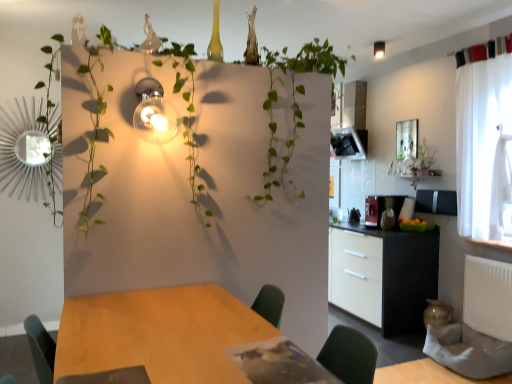
Question: Is green leafy plant at center outside of matte glass light fixture at upper right, which is the 1th light fixture in back-to-front order?

Choices:
 (A) no
 (B) yes

Answer: (B)

Question: Is green leafy plant at center oriented towards matte glass light fixture at upper right, the second light fixture positioned from the bottom?

Choices:
 (A) no
 (B) yes

Answer: (A)

Question: Does green leafy plant at center touch matte glass light fixture at upper right, the second light fixture positioned from the bottom?

Choices:
 (A) yes
 (B) no

Answer: (B)

Question: Does green leafy plant at center have a lesser width compared to matte glass light fixture at upper right, arranged as the first light fixture when viewed from the top?

Choices:
 (A) yes
 (B) no

Answer: (B)

Question: From a real-world perspective, is green leafy plant at center on top of matte glass light fixture at upper right, which appears as the 2th light fixture when viewed from the front?

Choices:
 (A) no
 (B) yes

Answer: (A)

Question: Is matte glass light fixture at upper right, the first light fixture positioned from the right, taller or shorter than black matte cabinet at right?

Choices:
 (A) tall
 (B) short

Answer: (B)

Question: Is matte glass light fixture at upper right, which is the second light fixture from left to right, bigger or smaller than black matte cabinet at right?

Choices:
 (A) big
 (B) small

Answer: (B)

Question: Is matte glass light fixture at upper right, the second light fixture positioned from the bottom, spatially inside black matte cabinet at right, or outside of it?

Choices:
 (A) inside
 (B) outside

Answer: (B)

Question: In terms of width, does matte glass light fixture at upper right, which is the 1th light fixture in back-to-front order, look wider or thinner when compared to black matte cabinet at right?

Choices:
 (A) thin
 (B) wide

Answer: (A)

Question: From their relative heights in the image, would you say white sheer curtain at right is taller or shorter than metallic bulb at upper left, the second light fixture positioned from the back?

Choices:
 (A) short
 (B) tall

Answer: (B)

Question: From the image's perspective, is white sheer curtain at right above or below metallic bulb at upper left, positioned as the 1th light fixture in bottom-to-top order?

Choices:
 (A) above
 (B) below

Answer: (B)

Question: Looking at their shapes, would you say white sheer curtain at right is wider or thinner than metallic bulb at upper left, acting as the 1th light fixture starting from the front?

Choices:
 (A) wide
 (B) thin

Answer: (B)

Question: Is white sheer curtain at right inside the boundaries of metallic bulb at upper left, the second light fixture positioned from the back, or outside?

Choices:
 (A) outside
 (B) inside

Answer: (A)

Question: Does point (160, 102) appear closer or farther from the camera than point (373, 240)?

Choices:
 (A) farther
 (B) closer

Answer: (B)

Question: Is metallic bulb at upper left, the second light fixture positioned from the back, in front of or behind black matte cabinet at right in the image?

Choices:
 (A) behind
 (B) front

Answer: (B)